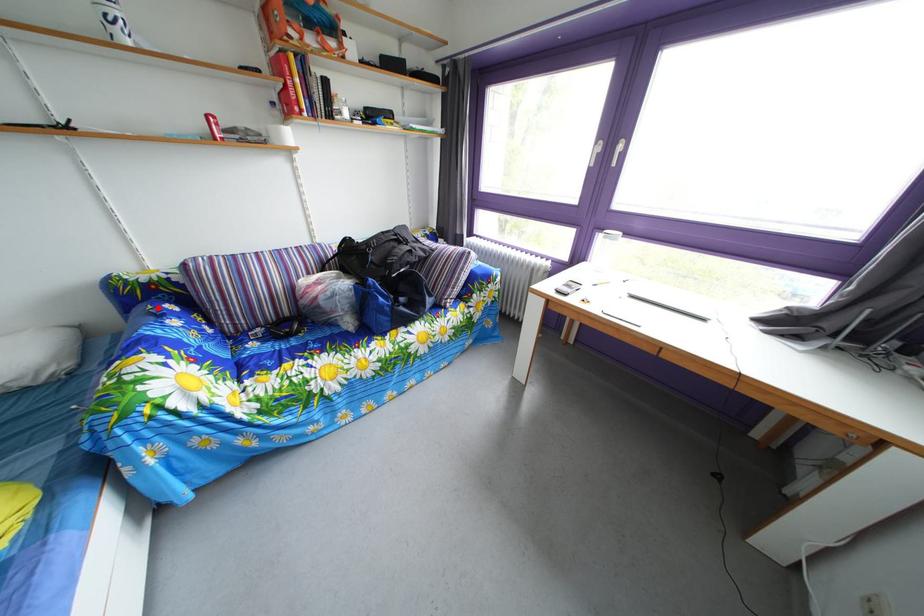
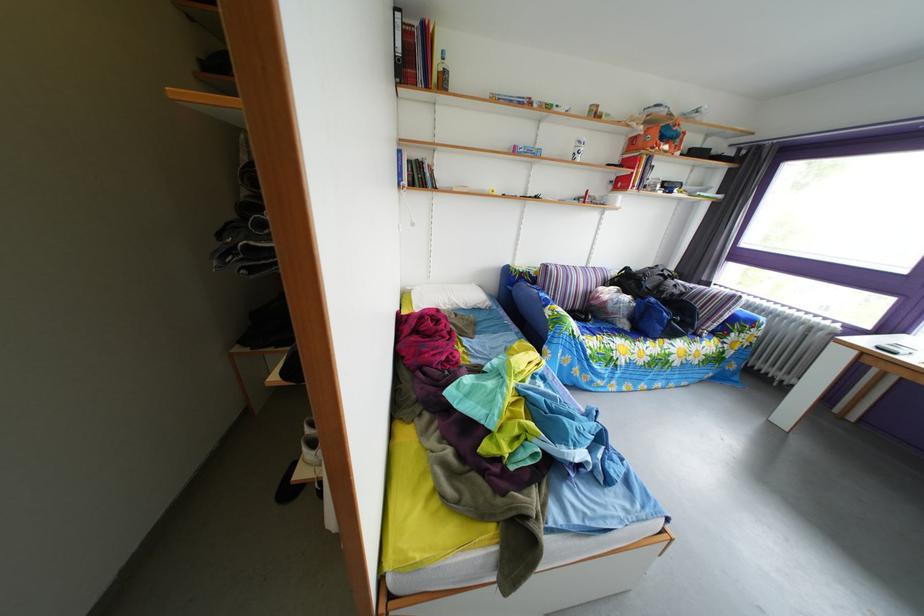
In the second image, find the point that corresponds to the highlighted location in the first image.

(529, 289)